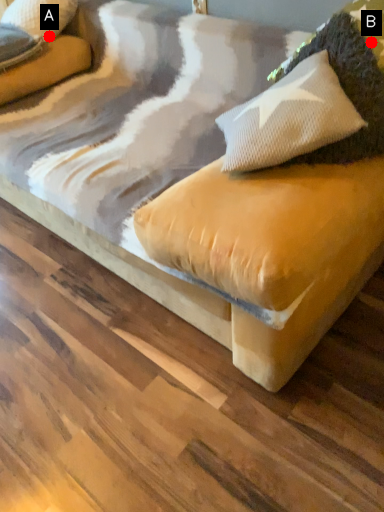
Question: Two points are circled on the image, labeled by A and B beside each circle. Which point appears farthest from the camera in this image?

Choices:
 (A) A is further
 (B) B is further

Answer: (A)